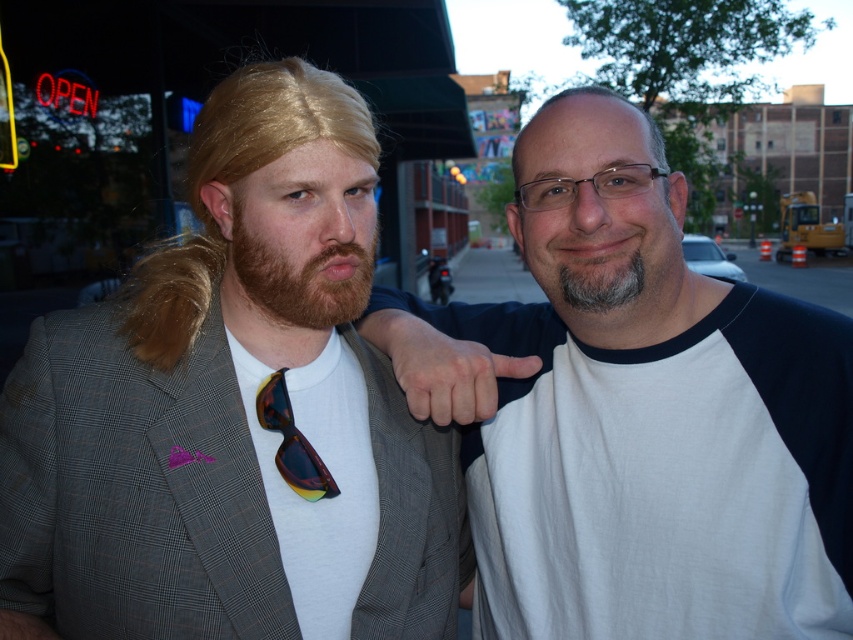
Which is behind, point (274, 257) or point (793, 564)?

Positioned behind is point (793, 564).

Can you confirm if matte gray blazer at left is bigger than white cotton t-shirt at right?

Incorrect, matte gray blazer at left is not larger than white cotton t-shirt at right.

Is point (216, 534) positioned in front of point (677, 582)?

Yes, it is in front of point (677, 582).

Find the location of a particular element. The width and height of the screenshot is (853, 640). matte gray blazer at left is located at coordinates (231, 412).

Who is positioned more to the left, matte gray blazer at left or multicolored plastic sunglasses at center?

matte gray blazer at left

This screenshot has width=853, height=640. What are the coordinates of `matte gray blazer at left` in the screenshot? It's located at (231, 412).

Identify the location of matte gray blazer at left. This screenshot has width=853, height=640. (231, 412).

Is dark brown beard at center wider than gray/soft hair at center?

Yes, dark brown beard at center is wider than gray/soft hair at center.

Locate an element on the screen. The width and height of the screenshot is (853, 640). dark brown beard at center is located at coordinates (303, 266).